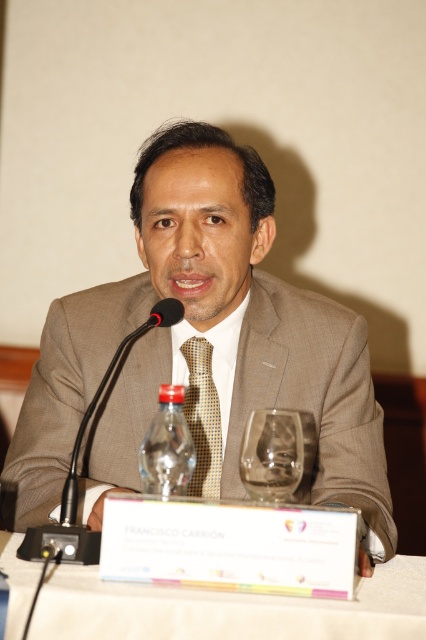
Question: Estimate the real-world distances between objects in this image. Which object is closer to the brown checkered tie at center?

Choices:
 (A) transparent glass at lower center
 (B) brown textured suit at center

Answer: (B)

Question: Is white paper at center to the right of brown checkered tie at center from the viewer's perspective?

Choices:
 (A) yes
 (B) no

Answer: (A)

Question: Which point is farther to the camera?

Choices:
 (A) (152, 458)
 (B) (118, 637)

Answer: (A)

Question: Can you confirm if transparent glass at lower center is wider than black plastic microphone at lower center?

Choices:
 (A) yes
 (B) no

Answer: (B)

Question: Is the position of white paper at center more distant than that of black plastic microphone at lower center?

Choices:
 (A) no
 (B) yes

Answer: (A)

Question: Which is nearer to the black matte microphone at left?

Choices:
 (A) white paper at center
 (B) black plastic microphone at lower center
 (C) brown textured suit at center

Answer: (B)